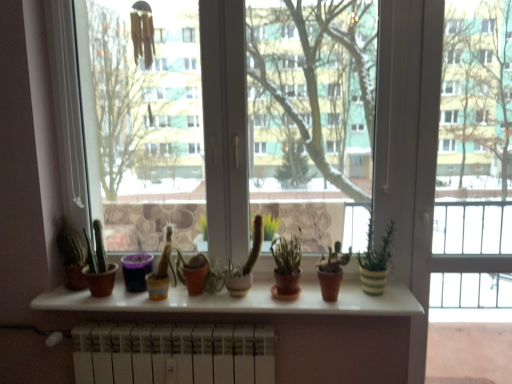
Question: Which direction should I rotate to face green matte cactus at center, which appears as the 4th houseplant when viewed from the right, — up or down?

Choices:
 (A) down
 (B) up

Answer: (A)

Question: Is green matte cactus at center, which is the 3th houseplant from right to left, taller than matte terracotta pot at center, the 1th flowerpot from the right?

Choices:
 (A) no
 (B) yes

Answer: (B)

Question: Can we say green matte cactus at center, which is the 3th houseplant from right to left, lies outside matte terracotta pot at center, the 2th flowerpot when ordered from left to right?

Choices:
 (A) no
 (B) yes

Answer: (B)

Question: Would you consider green matte cactus at center, which is the 3th houseplant from right to left, to be distant from matte terracotta pot at center, the 1th flowerpot from the right?

Choices:
 (A) no
 (B) yes

Answer: (A)

Question: From a real-world perspective, is green matte cactus at center, the fourth houseplant in the left-to-right sequence, positioned under matte terracotta pot at center, the 2th flowerpot when ordered from left to right, based on gravity?

Choices:
 (A) no
 (B) yes

Answer: (A)

Question: Could you tell me if green matte cactus at center, the fourth houseplant in the left-to-right sequence, is facing matte terracotta pot at center, the 1th flowerpot from the right?

Choices:
 (A) no
 (B) yes

Answer: (A)

Question: From the image's perspective, is green matte cactus at center, the fourth houseplant in the left-to-right sequence, above matte terracotta pot at center, the 2th flowerpot when ordered from left to right?

Choices:
 (A) no
 (B) yes

Answer: (B)

Question: Can you confirm if matte brown cactus at left, acting as the 5th houseplant starting from the right, is wider than green striped pot at right, marked as the 6th houseplant in a left-to-right arrangement?

Choices:
 (A) no
 (B) yes

Answer: (B)

Question: Is there a large distance between matte brown cactus at left, acting as the 5th houseplant starting from the right, and green striped pot at right, positioned as the first houseplant in right-to-left order?

Choices:
 (A) yes
 (B) no

Answer: (A)

Question: From the image's perspective, is matte brown cactus at left, acting as the 5th houseplant starting from the right, located beneath green striped pot at right, positioned as the first houseplant in right-to-left order?

Choices:
 (A) no
 (B) yes

Answer: (B)

Question: Can you confirm if matte brown cactus at left, the second houseplant positioned from the left, is bigger than green striped pot at right, positioned as the first houseplant in right-to-left order?

Choices:
 (A) no
 (B) yes

Answer: (A)

Question: From a real-world perspective, is matte brown cactus at left, the second houseplant positioned from the left, physically below green striped pot at right, positioned as the first houseplant in right-to-left order?

Choices:
 (A) no
 (B) yes

Answer: (B)

Question: From a real-world perspective, is matte brown cactus at left, acting as the 5th houseplant starting from the right, on green striped pot at right, positioned as the first houseplant in right-to-left order?

Choices:
 (A) no
 (B) yes

Answer: (A)

Question: Is matte terracotta pot at center, the 1th flowerpot from the right, oriented towards terracotta clay pot at center, which ranks as the second houseplant in right-to-left order?

Choices:
 (A) no
 (B) yes

Answer: (A)